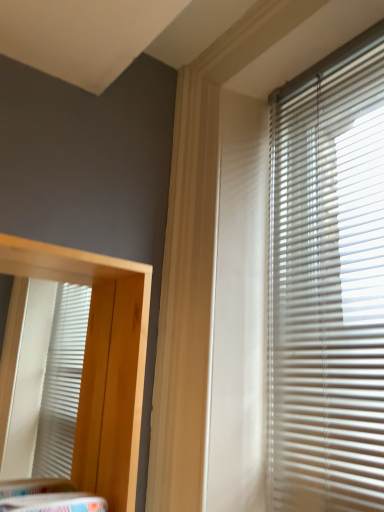
At what (x,y) coordinates should I click in order to perform the action: click on white plastic blinds at right. Please return your answer as a coordinate pair (x, y). Looking at the image, I should click on (328, 283).

Measure the distance between white plastic blinds at right and camera.

The distance of white plastic blinds at right from camera is 27.67 inches.

What do you see at coordinates (328, 283) in the screenshot? I see `white plastic blinds at right` at bounding box center [328, 283].

Where is `white plastic blinds at right`? This screenshot has width=384, height=512. white plastic blinds at right is located at coordinates (328, 283).